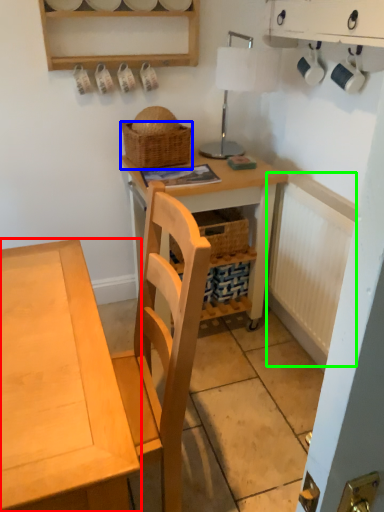
Question: Estimate the real-world distances between objects in this image. Which object is farther from desk (highlighted by a red box), picnic basket (highlighted by a blue box) or radiator (highlighted by a green box)?

Choices:
 (A) picnic basket
 (B) radiator

Answer: (B)